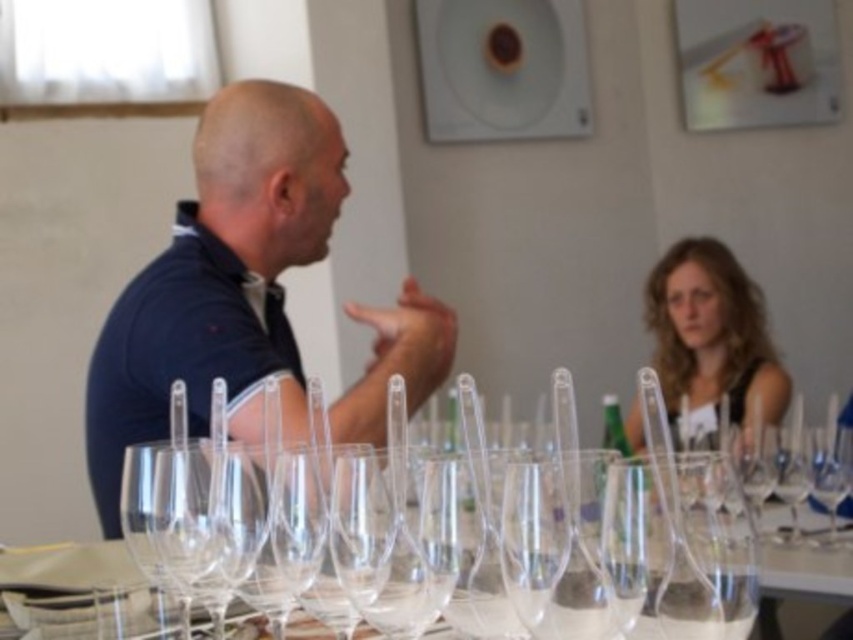
Question: Is dark blue shirt at left thinner than blonde hair at upper right?

Choices:
 (A) no
 (B) yes

Answer: (A)

Question: Is dark blue shirt at left to the right of blonde hair at upper right from the viewer's perspective?

Choices:
 (A) no
 (B) yes

Answer: (A)

Question: Does dark blue shirt at left have a smaller size compared to blonde hair at upper right?

Choices:
 (A) no
 (B) yes

Answer: (B)

Question: Which point appears farthest from the camera in this image?

Choices:
 (A) (235, 280)
 (B) (786, 396)

Answer: (B)